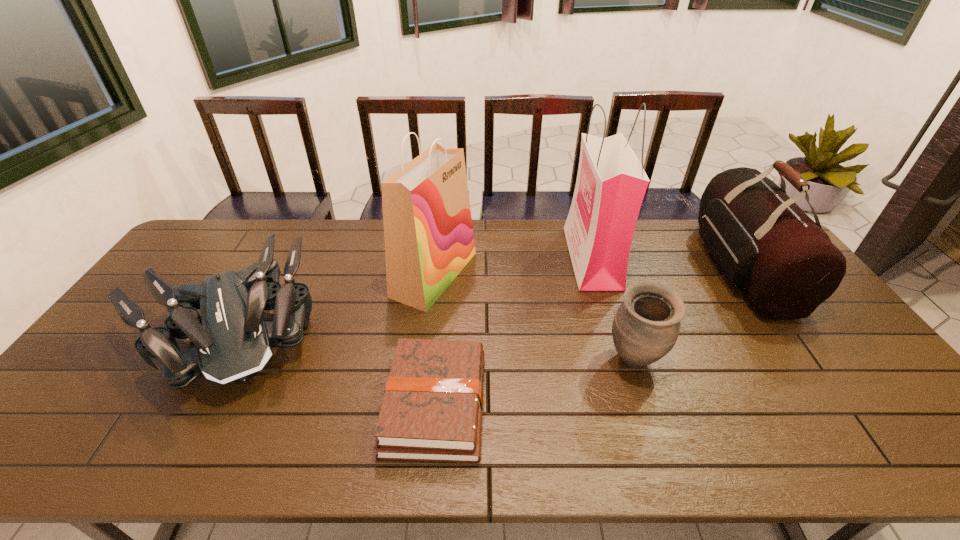
Identify the location of object that is at the left edge. (233, 341).

You are a GUI agent. You are given a task and a screenshot of the screen. Output one action in this format:
    pyautogui.click(x=<x>, y=<y>)
    Task: Click on the object present at the right edge
    The height and width of the screenshot is (540, 960).
    Given the screenshot: What is the action you would take?
    pyautogui.click(x=785, y=265)

Find the location of a particular element. object present at the far right corner is located at coordinates (785, 265).

You are a GUI agent. You are given a task and a screenshot of the screen. Output one action in this format:
    pyautogui.click(x=<x>, y=<y>)
    Task: Click on the vacant space at the far edge of the desktop
    The image size is (960, 540).
    Given the screenshot: What is the action you would take?
    pyautogui.click(x=667, y=235)

You are a GUI agent. You are given a task and a screenshot of the screen. Output one action in this format:
    pyautogui.click(x=<x>, y=<y>)
    Task: Click on the free space at the near edge
    The width and height of the screenshot is (960, 540).
    Given the screenshot: What is the action you would take?
    pyautogui.click(x=534, y=457)

Image resolution: width=960 pixels, height=540 pixels. In the image, there is a desktop. Identify the location of vacant space at the left edge. (120, 367).

The image size is (960, 540). Identify the location of vacant region at the right edge of the desktop. (846, 375).

The image size is (960, 540). In the image, there is a desktop. In order to click on vacant area at the near right corner in this screenshot , I will do `click(931, 438)`.

This screenshot has height=540, width=960. Find the location of `empty space between the shortest object and the right shopping bag`. empty space between the shortest object and the right shopping bag is located at coordinates (514, 331).

The height and width of the screenshot is (540, 960). I want to click on vacant area that lies between the shortest object and the urn, so click(535, 382).